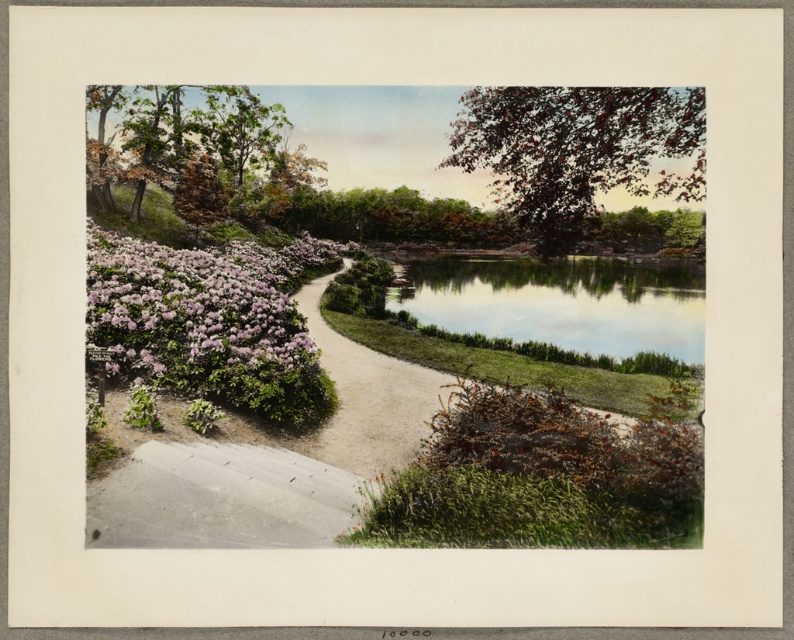
Question: Is the position of smooth brown tree at upper right less distant than that of sandy gravel path at center?

Choices:
 (A) yes
 (B) no

Answer: (A)

Question: Among these objects, which one is nearest to the camera?

Choices:
 (A) brown textured tree at upper left
 (B) smooth brown tree at upper right
 (C) pink matte flowers at left
 (D) sandy gravel path at center

Answer: (B)

Question: Among these points, which one is nearest to the camera?

Choices:
 (A) (222, 310)
 (B) (102, 209)
 (C) (521, 113)

Answer: (C)

Question: Does pink matte flowers at left have a larger size compared to brown textured tree at upper left?

Choices:
 (A) no
 (B) yes

Answer: (A)

Question: Is brown textured tree at upper left bigger than sandy gravel path at center?

Choices:
 (A) yes
 (B) no

Answer: (A)

Question: Among these objects, which one is nearest to the camera?

Choices:
 (A) brown textured tree at upper left
 (B) smooth brown tree at upper right
 (C) pink matte flowers at left

Answer: (B)